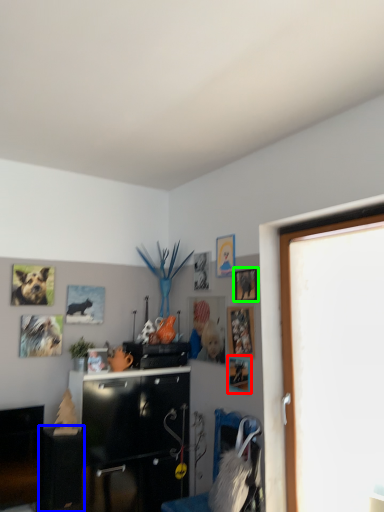
Question: Considering the real-world distances, which object is farthest from picture frame (highlighted by a red box)? table (highlighted by a blue box) or picture frame (highlighted by a green box)?

Choices:
 (A) table
 (B) picture frame

Answer: (A)